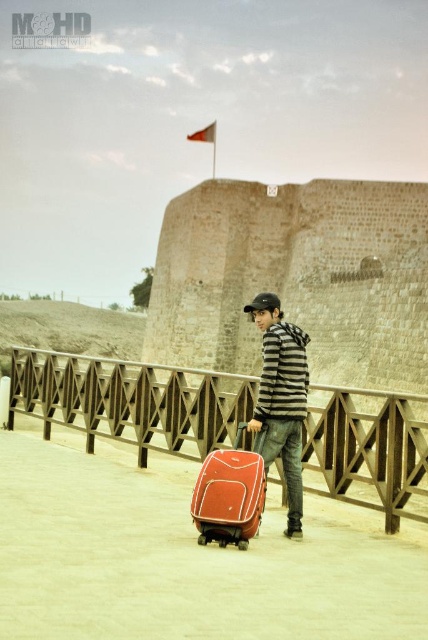
Question: Based on their relative distances, which object is nearer to the wooden rail at center?

Choices:
 (A) matte red suitcase at center
 (B) striped hoodie at center

Answer: (B)

Question: Which point is closer to the camera taking this photo?

Choices:
 (A) (359, 445)
 (B) (293, 420)
 (C) (240, 474)

Answer: (C)

Question: Does striped hoodie at center appear over matte red suitcase at center?

Choices:
 (A) no
 (B) yes

Answer: (B)

Question: From the image, what is the correct spatial relationship of striped hoodie at center in relation to matte red suitcase at center?

Choices:
 (A) below
 (B) above

Answer: (B)

Question: Considering the real-world distances, which object is closest to the wooden rail at center?

Choices:
 (A) matte red suitcase at center
 (B) striped hoodie at center

Answer: (B)

Question: Where is wooden rail at center located in relation to striped hoodie at center in the image?

Choices:
 (A) above
 (B) below

Answer: (B)